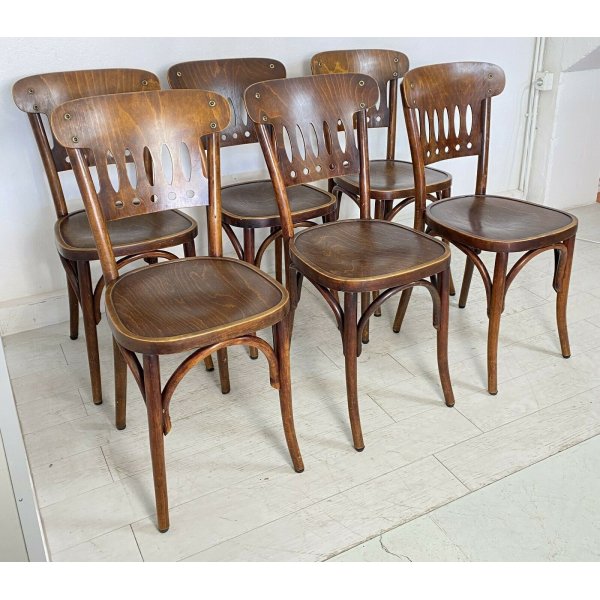
Identify the location of chairs. (75, 82), (133, 112), (210, 75), (311, 94), (377, 67), (447, 84).